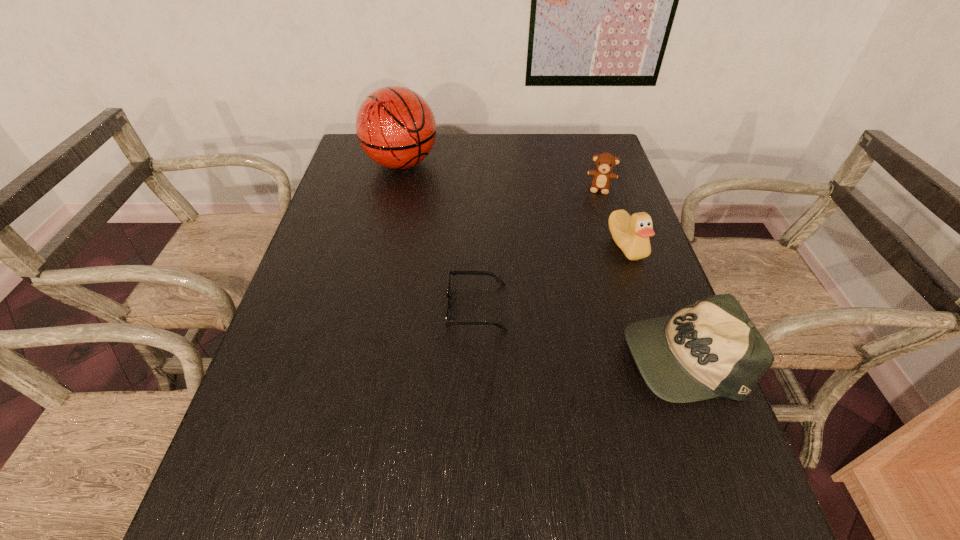
Find the location of `free space at the far right corner of the desktop`. free space at the far right corner of the desktop is located at coordinates (604, 135).

I want to click on vacant area that lies between the teddy bear and the sunglasses, so click(x=539, y=247).

What are the coordinates of `empty location between the basketball and the teddy bear` in the screenshot? It's located at (501, 176).

The width and height of the screenshot is (960, 540). I want to click on vacant area that lies between the sunglasses and the leftmost object, so click(x=439, y=235).

Where is `free point between the teddy bear and the sunglasses`? free point between the teddy bear and the sunglasses is located at coordinates (x=539, y=247).

Locate an element on the screen. The image size is (960, 540). free area in between the shortest object and the basketball is located at coordinates (439, 235).

At what (x,y) coordinates should I click in order to perform the action: click on empty space that is in between the tallest object and the third farthest object. Please return your answer as a coordinate pair (x, y). The width and height of the screenshot is (960, 540). Looking at the image, I should click on (514, 205).

At what (x,y) coordinates should I click in order to perform the action: click on free area in between the second object from left to right and the baseball cap. Please return your answer as a coordinate pair (x, y). This screenshot has height=540, width=960. Looking at the image, I should click on (579, 331).

This screenshot has width=960, height=540. Identify the location of empty space between the baseball cap and the third farthest object. (654, 300).

Locate which object is the fourth closest to the third nearest object. Please provide its 2D coordinates. Your answer should be formatted as a tuple, i.e. [(x, y)], where the tuple contains the x and y coordinates of a point satisfying the conditions above.

[(395, 126)]